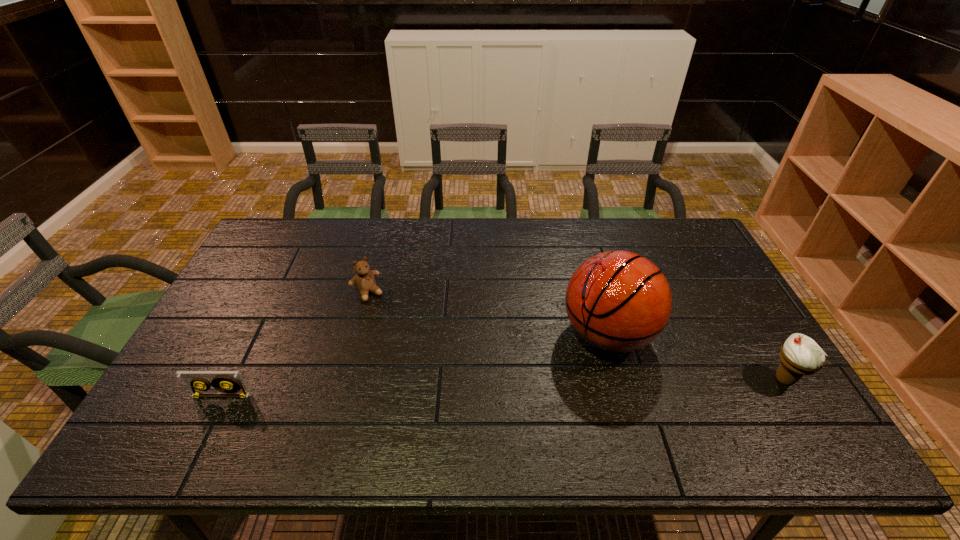
Identify the location of videotape. The height and width of the screenshot is (540, 960). (225, 383).

Locate an element on the screen. Image resolution: width=960 pixels, height=540 pixels. the shortest object is located at coordinates (225, 383).

At what (x,y) coordinates should I click in order to perform the action: click on icecream. Please return your answer as a coordinate pair (x, y). Looking at the image, I should click on [800, 355].

Locate an element on the screen. This screenshot has width=960, height=540. the rightmost object is located at coordinates (800, 355).

The height and width of the screenshot is (540, 960). In order to click on basketball in this screenshot , I will do `click(618, 301)`.

Find the location of `the tallest object`. the tallest object is located at coordinates (618, 301).

Image resolution: width=960 pixels, height=540 pixels. In order to click on the third object from right to left in this screenshot , I will do `click(364, 280)`.

Image resolution: width=960 pixels, height=540 pixels. I want to click on the second shortest object, so click(x=364, y=280).

The height and width of the screenshot is (540, 960). What are the coordinates of `vacant region located 0.250m on the back of the second tallest object` in the screenshot? It's located at (734, 298).

Image resolution: width=960 pixels, height=540 pixels. Identify the location of vacant position located on the side with spill of the basketball. (515, 393).